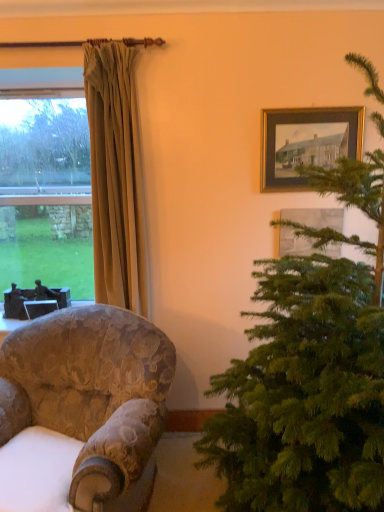
Question: Based on their sizes in the image, would you say clear glass window at left is bigger or smaller than wooden framed picture at upper right, which is the third picture frame in left-to-right order?

Choices:
 (A) small
 (B) big

Answer: (B)

Question: From the image's perspective, relative to wooden framed picture at upper right, which is the third picture frame in left-to-right order, is clear glass window at left above or below?

Choices:
 (A) below
 (B) above

Answer: (B)

Question: Which object is the farthest from the wooden framed picture at upper right, which is the 2th picture frame in back-to-front order?

Choices:
 (A) metallic silver picture frame at upper left, the 1th picture frame ordered from the bottom
 (B) green needle-like at right
 (C) floral fabric armchair at lower left
 (D) clear glass window at left
 (E) gold-framed picture at upper right, which is the first picture frame from front to back

Answer: (A)

Question: Estimate the real-world distances between objects in this image. Which object is closer to the clear glass window at left?

Choices:
 (A) wooden framed picture at upper right, positioned as the second picture frame in front-to-back order
 (B) beige fabric curtain at left
 (C) green needle-like at right
 (D) gold-framed picture at upper right, which ranks as the 3th picture frame in back-to-front order
 (E) floral fabric armchair at lower left

Answer: (B)